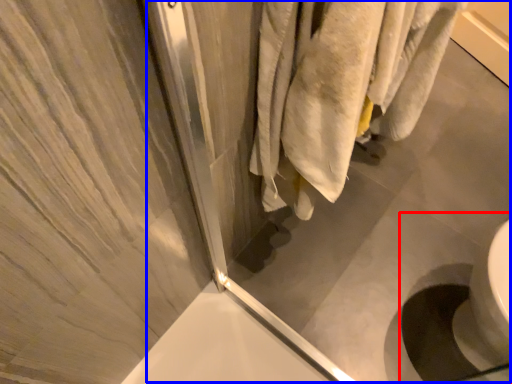
Question: Among these objects, which one is nearest to the camera, sink (highlighted by a red box) or screen door (highlighted by a blue box)?

Choices:
 (A) sink
 (B) screen door

Answer: (B)